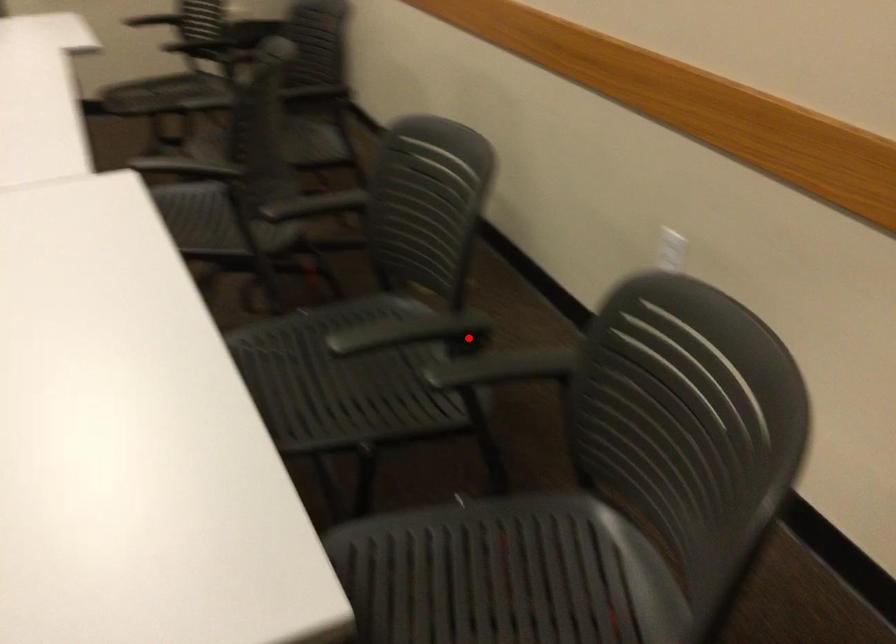
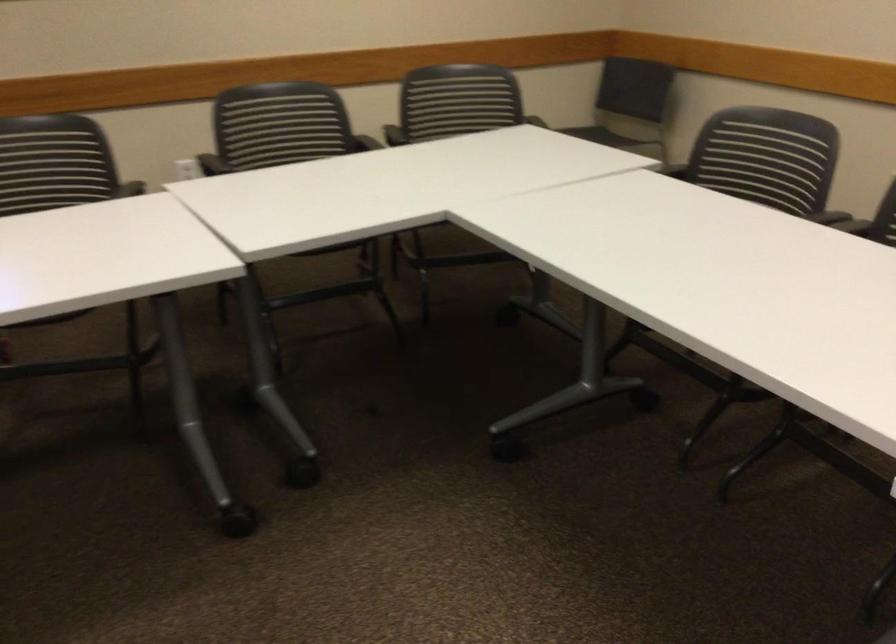
Find the pixel in the second image that matches the highlighted location in the first image.

(360, 142)